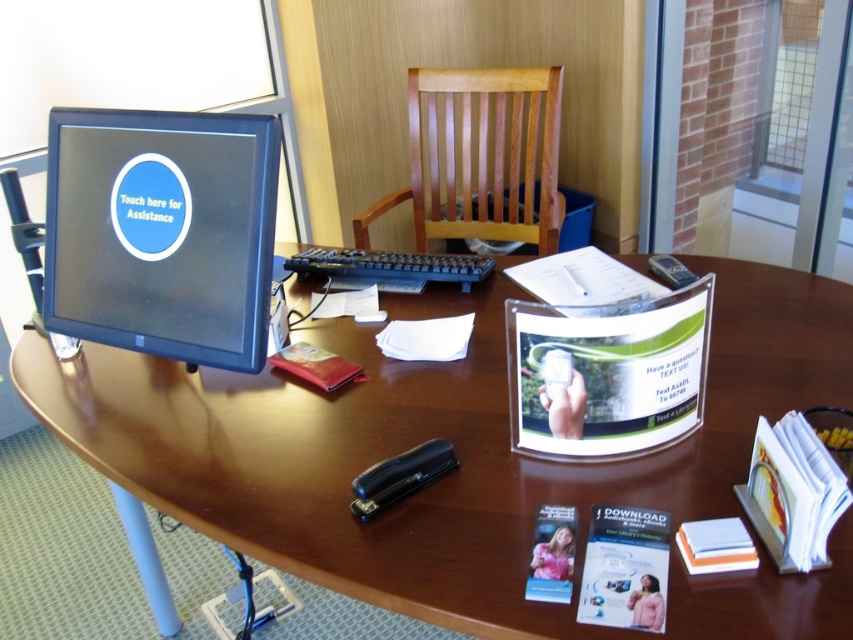
Question: Does matte black monitor at left have a greater width compared to wooden slats chair at center?

Choices:
 (A) no
 (B) yes

Answer: (A)

Question: In this image, where is wooden computer desk at center located relative to wooden slats chair at center?

Choices:
 (A) left
 (B) right

Answer: (A)

Question: Which object is farther from the camera taking this photo?

Choices:
 (A) wooden computer desk at center
 (B) black plastic keyboard at center
 (C) wooden slats chair at center
 (D) matte black monitor at left

Answer: (C)

Question: Which point is closer to the camera?

Choices:
 (A) (215, 317)
 (B) (474, 276)
 (C) (628, 476)

Answer: (C)

Question: Which object appears closest to the camera in this image?

Choices:
 (A) black plastic keyboard at center
 (B) matte black monitor at left
 (C) wooden computer desk at center

Answer: (C)

Question: Is wooden computer desk at center positioned in front of matte black monitor at left?

Choices:
 (A) yes
 (B) no

Answer: (A)